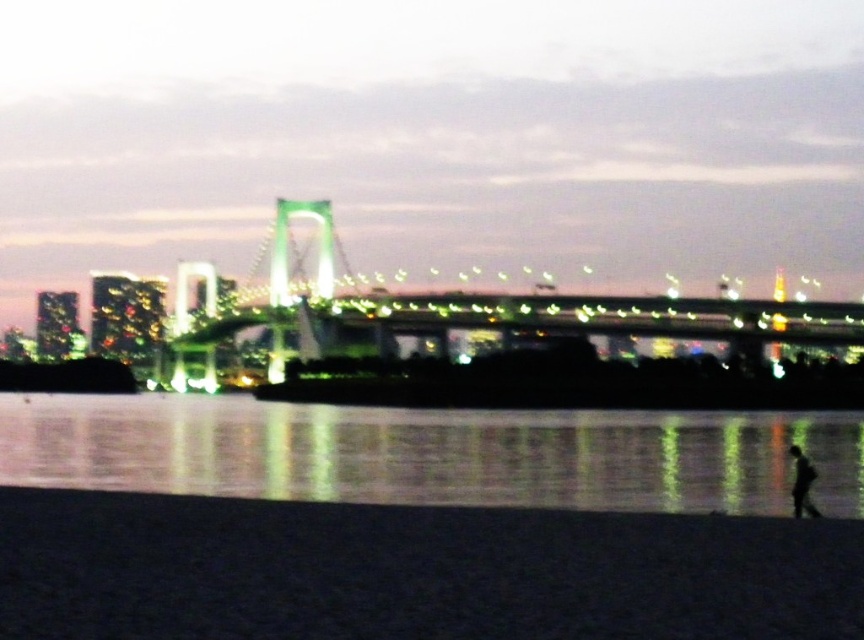
Question: Does dark sand at lower center have a lesser width compared to black matte figure at lower right?

Choices:
 (A) yes
 (B) no

Answer: (A)

Question: Among these points, which one is nearest to the camera?

Choices:
 (A) 767,305
 (B) 596,506
 (C) 788,449

Answer: (B)

Question: Can you confirm if reflective glass water at lower center is positioned to the right of green metallic bridge at center?

Choices:
 (A) yes
 (B) no

Answer: (B)

Question: Based on their relative distances, which object is farther from the green metallic bridge at center?

Choices:
 (A) reflective glass water at lower center
 (B) dark sand at lower center

Answer: (B)

Question: Is green metallic bridge at center behind black matte figure at lower right?

Choices:
 (A) no
 (B) yes

Answer: (B)

Question: Which object appears farthest from the camera in this image?

Choices:
 (A) black matte figure at lower right
 (B) dark sand at lower center
 (C) green metallic bridge at center

Answer: (C)